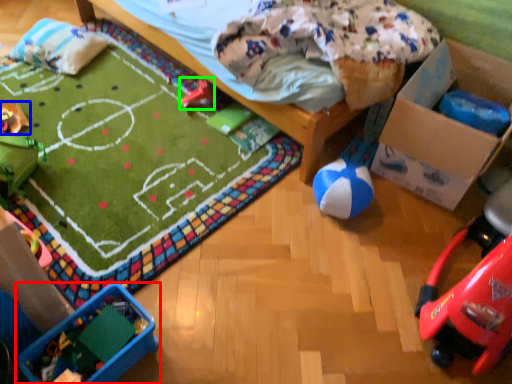
Question: Which object is the closest to the toy (highlighted by a red box)? Choose among these: toy (highlighted by a blue box) or toy (highlighted by a green box).

Choices:
 (A) toy
 (B) toy

Answer: (A)